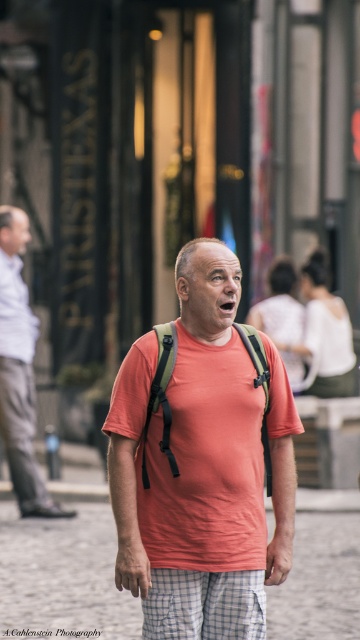
You are a photographer who wants to focus on the man in the bright orange tshirt and checkered shorts. You notice a point at coordinates (19, 371) in the image. Based on the scene description, where is this point located?

The point at coordinates (19, 371) is located on the matte white shirt at center.

You are a photographer who wants to ensure proper focus on both the matte white shirt at center and the white checkered shorts at center. Given their relative heights, which object should you adjust your focus settings to prioritize to ensure both are in focus?

The matte white shirt at center has a greater height compared to white checkered shorts at center. To ensure both are in focus, prioritize focusing on the matte white shirt at center since it is taller and requires more depth of field coverage.